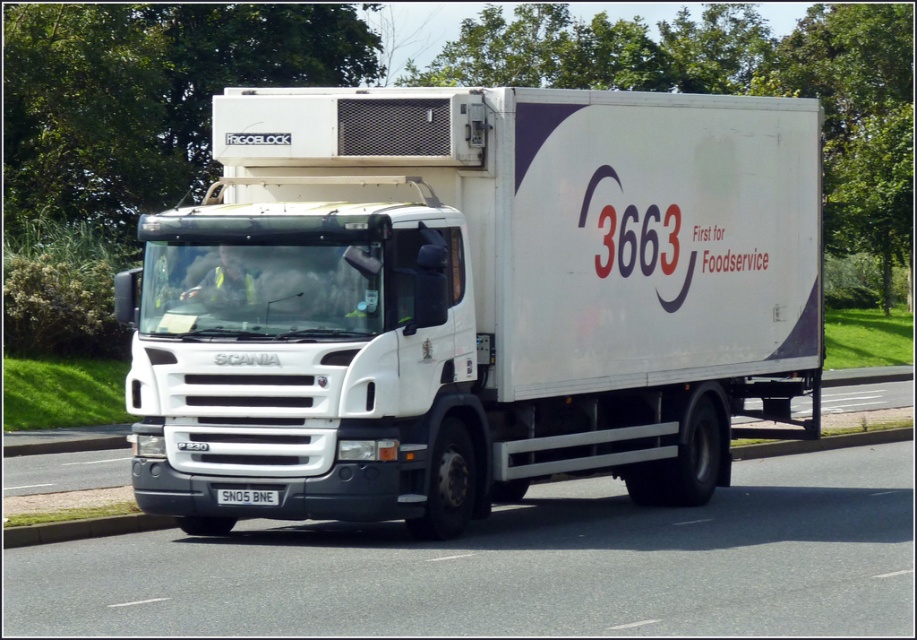
Who is higher up, white matte truck at center or white metallic license plate at center?

white metallic license plate at center is above.

Can you confirm if white matte truck at center is thinner than white metallic license plate at center?

Yes, white matte truck at center is thinner than white metallic license plate at center.

Find the location of a particular element. The height and width of the screenshot is (640, 917). white matte truck at center is located at coordinates (473, 300).